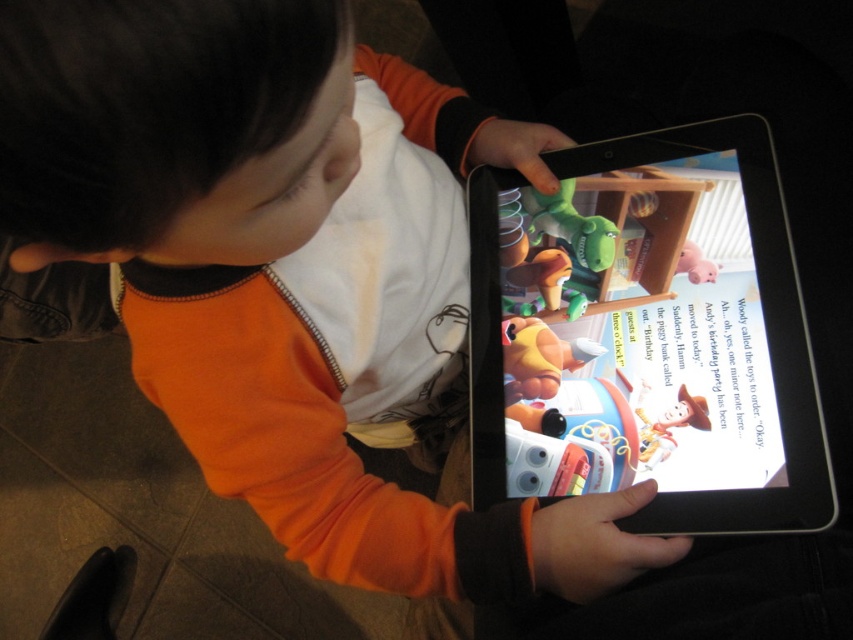
Question: Is the position of black plastic tablet at center more distant than that of matte green plush dinosaur at center?

Choices:
 (A) yes
 (B) no

Answer: (B)

Question: Is yellow rubber duck at center further to camera compared to pink rubber pig at upper right?

Choices:
 (A) no
 (B) yes

Answer: (B)

Question: Among these objects, which one is farthest from the camera?

Choices:
 (A) pink rubber pig at upper right
 (B) yellow rubber duck at center
 (C) black plastic tablet at center
 (D) matte green plush dinosaur at center

Answer: (D)

Question: Can you confirm if black plastic tablet at center is positioned below matte green plush dinosaur at center?

Choices:
 (A) yes
 (B) no

Answer: (A)

Question: Which object is positioned farthest from the matte green plush dinosaur at center?

Choices:
 (A) yellow rubber duck at center
 (B) pink rubber pig at upper right
 (C) black plastic tablet at center

Answer: (C)

Question: Which is nearer to the pink rubber pig at upper right?

Choices:
 (A) black plastic tablet at center
 (B) yellow rubber duck at center

Answer: (A)